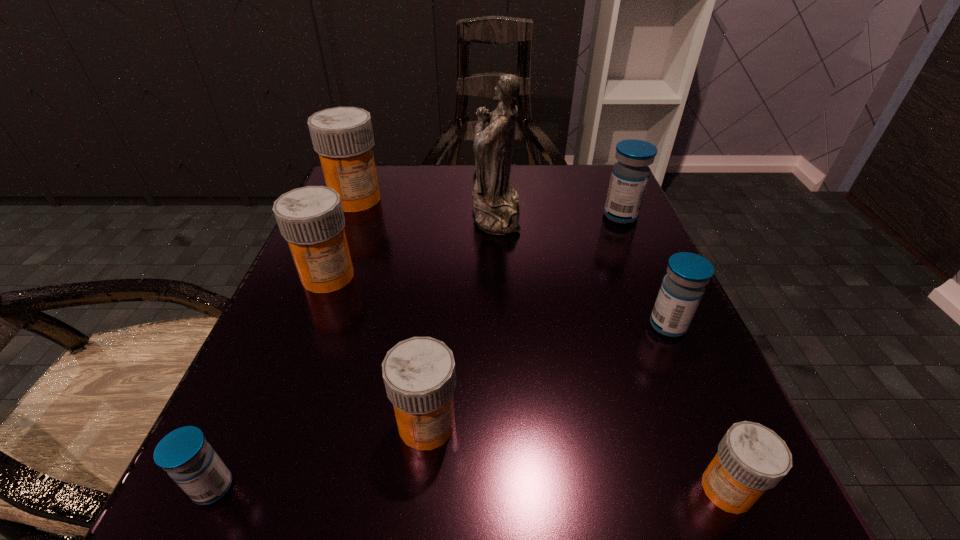
This screenshot has height=540, width=960. Find the location of `the tallest object`. the tallest object is located at coordinates (496, 207).

Find the location of a particular element. This screenshot has height=540, width=960. the fifth object from left to right is located at coordinates (496, 207).

This screenshot has width=960, height=540. In order to click on the biggest orange medicine in this screenshot , I will do `click(343, 137)`.

Image resolution: width=960 pixels, height=540 pixels. I want to click on the farthest orange medicine, so click(343, 137).

I want to click on the biggest blue medicine, so click(x=630, y=175).

You are a GUI agent. You are given a task and a screenshot of the screen. Output one action in this format:
    pyautogui.click(x=<x>, y=<y>)
    Task: Click on the second biggest orange medicine
    This screenshot has height=540, width=960.
    Given the screenshot: What is the action you would take?
    pyautogui.click(x=311, y=219)

You are a GUI agent. You are given a task and a screenshot of the screen. Output one action in this format:
    pyautogui.click(x=<x>, y=<y>)
    Task: Click on the fifth nearest object
    The width and height of the screenshot is (960, 540).
    Given the screenshot: What is the action you would take?
    pyautogui.click(x=311, y=219)

In order to click on the sixth farthest object in this screenshot , I will do `click(419, 375)`.

I want to click on the fifth farthest medicine, so click(x=419, y=375).

The image size is (960, 540). Find the location of `the second farthest blue medicine`. the second farthest blue medicine is located at coordinates (682, 288).